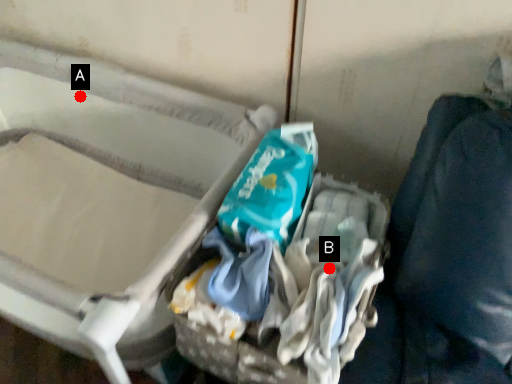
Question: Two points are circled on the image, labeled by A and B beside each circle. Which point is further to the camera?

Choices:
 (A) A is further
 (B) B is further

Answer: (A)